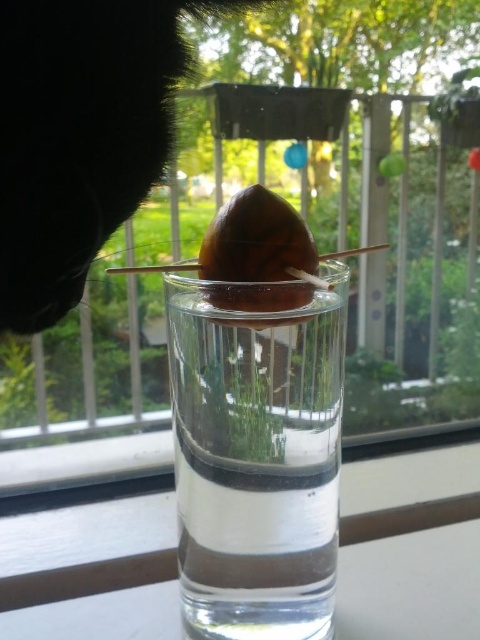
Question: Can you confirm if clear glass vase at center is bigger than black fur cat at upper left?

Choices:
 (A) no
 (B) yes

Answer: (A)

Question: Based on their relative distances, which object is farther from the brown matte acorn at center?

Choices:
 (A) black fur cat at upper left
 (B) clear glass vase at center

Answer: (A)

Question: Among these points, which one is nearest to the camera?

Choices:
 (A) (276, 253)
 (B) (323, 333)
 (C) (124, 161)

Answer: (B)

Question: Which point appears farthest from the camera in this image?

Choices:
 (A) (21, 273)
 (B) (218, 301)

Answer: (A)

Question: Does clear glass vase at center have a larger size compared to brown matte acorn at center?

Choices:
 (A) no
 (B) yes

Answer: (B)

Question: Is the position of clear glass vase at center less distant than that of black fur cat at upper left?

Choices:
 (A) yes
 (B) no

Answer: (A)